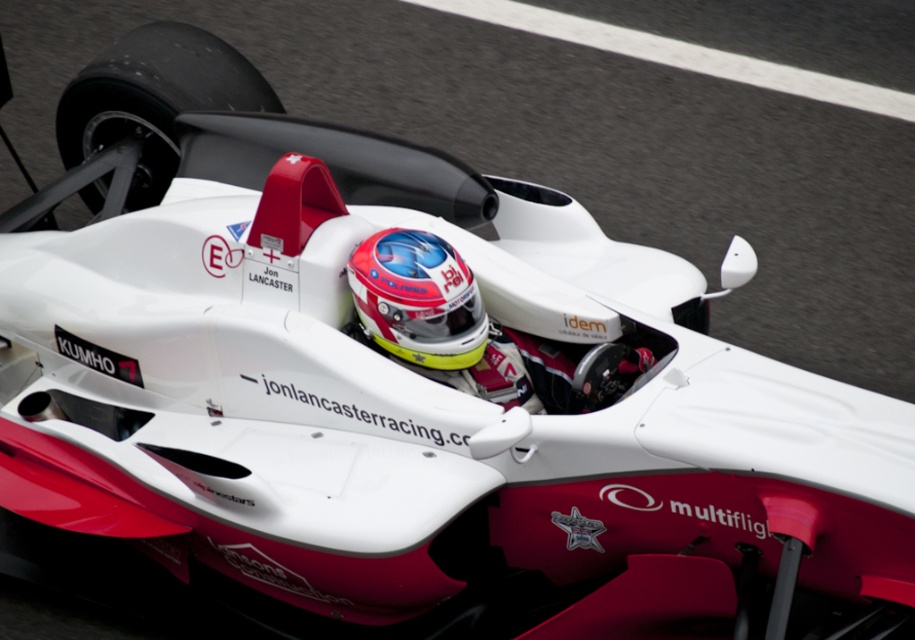
This screenshot has height=640, width=915. Find the location of `shiny white helmet at center`. shiny white helmet at center is located at coordinates (468, 330).

Measure the distance between point (368, 269) and camera.

4.36 meters

Who is more forward, (427, 240) or (422, 356)?

Positioned in front is point (422, 356).

Locate an element on the screen. This screenshot has height=640, width=915. shiny white helmet at center is located at coordinates (468, 330).